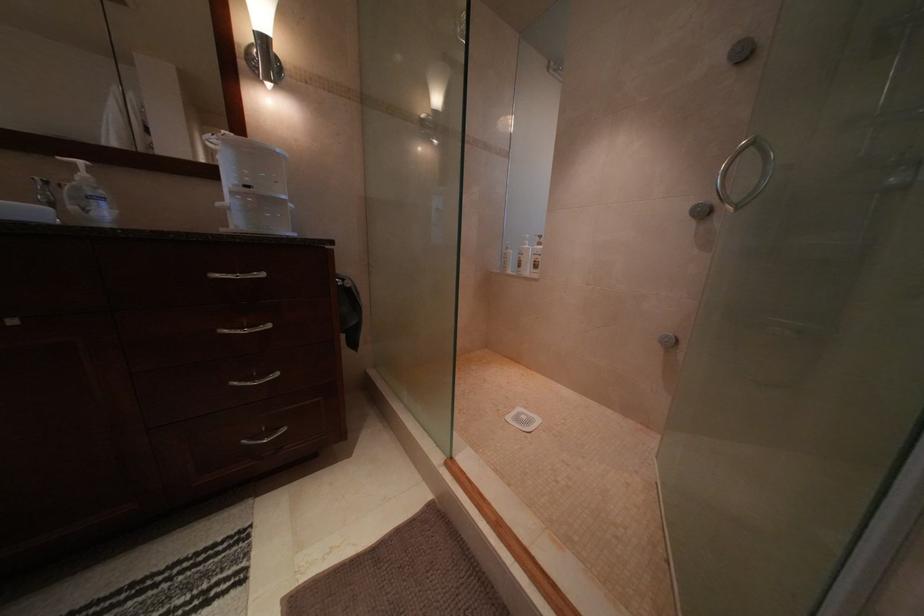
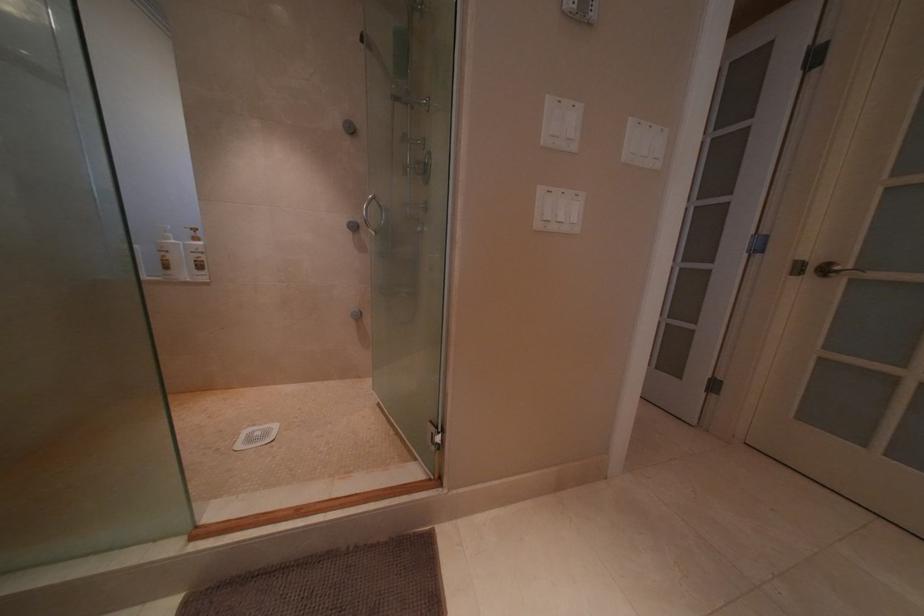
Question: How did the camera likely rotate?

Choices:
 (A) Left
 (B) Right
 (C) Up
 (D) Down

Answer: (B)